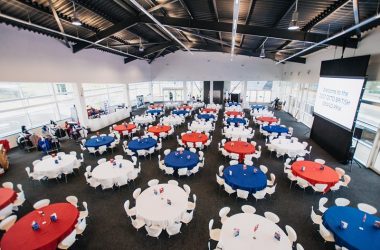
This screenshot has height=250, width=380. I want to click on chairs, so click(x=313, y=218), click(x=326, y=204), click(x=322, y=231), click(x=339, y=199), click(x=364, y=208), click(x=338, y=248).